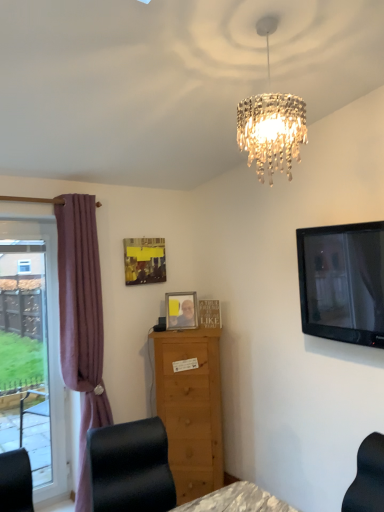
Question: Is matte plastic picture frame at center, the 2th picture frame viewed from the left, not inside mauve fabric curtain at left?

Choices:
 (A) no
 (B) yes

Answer: (B)

Question: Does matte plastic picture frame at center, which is the 2th picture frame from right to left, lie behind mauve fabric curtain at left?

Choices:
 (A) no
 (B) yes

Answer: (B)

Question: From a real-world perspective, is matte plastic picture frame at center, the 2th picture frame viewed from the left, beneath mauve fabric curtain at left?

Choices:
 (A) yes
 (B) no

Answer: (B)

Question: Is matte plastic picture frame at center, the 2th picture frame viewed from the left, positioned before mauve fabric curtain at left?

Choices:
 (A) no
 (B) yes

Answer: (A)

Question: Does matte plastic picture frame at center, which is the 2th picture frame from right to left, turn towards mauve fabric curtain at left?

Choices:
 (A) yes
 (B) no

Answer: (B)

Question: Considering the relative positions of matte plastic picture frame at center, which is the 2th picture frame from right to left, and mauve fabric curtain at left in the image provided, is matte plastic picture frame at center, which is the 2th picture frame from right to left, to the left of mauve fabric curtain at left from the viewer's perspective?

Choices:
 (A) yes
 (B) no

Answer: (B)

Question: Is black glossy tv at upper right positioned before clear glass window at left?

Choices:
 (A) yes
 (B) no

Answer: (A)

Question: Is black glossy tv at upper right taller than clear glass window at left?

Choices:
 (A) yes
 (B) no

Answer: (B)

Question: Is black glossy tv at upper right bigger than clear glass window at left?

Choices:
 (A) yes
 (B) no

Answer: (B)

Question: Would you say clear glass window at left is part of black glossy tv at upper right's contents?

Choices:
 (A) no
 (B) yes

Answer: (A)

Question: Is black glossy tv at upper right wider than clear glass window at left?

Choices:
 (A) yes
 (B) no

Answer: (A)

Question: From a real-world perspective, does black glossy tv at upper right stand above clear glass window at left?

Choices:
 (A) no
 (B) yes

Answer: (B)

Question: Is wooden picture frame at center, positioned as the 1th picture frame in right-to-left order, further to the viewer compared to black glossy tv at upper right?

Choices:
 (A) no
 (B) yes

Answer: (B)